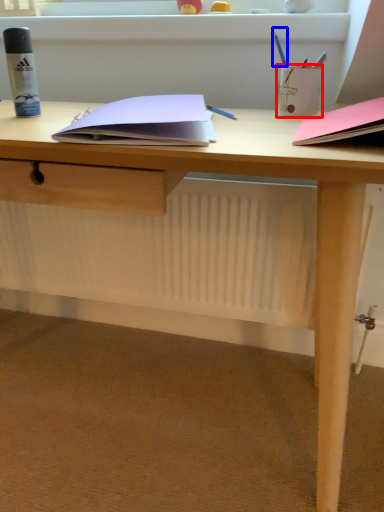
Question: Among these objects, which one is farthest to the camera, stationery (highlighted by a red box) or stationery (highlighted by a blue box)?

Choices:
 (A) stationery
 (B) stationery

Answer: (B)